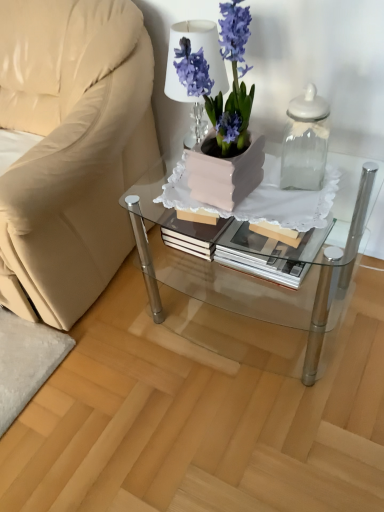
Question: Should I look upward or downward to see beige fabric chair at left?

Choices:
 (A) up
 (B) down

Answer: (A)

Question: Considering the relative sizes of white glossy table lamp at upper center and matte ceramic vase at center in the image provided, is white glossy table lamp at upper center shorter than matte ceramic vase at center?

Choices:
 (A) no
 (B) yes

Answer: (B)

Question: From the image's perspective, is white glossy table lamp at upper center above matte ceramic vase at center?

Choices:
 (A) no
 (B) yes

Answer: (B)

Question: Does white glossy table lamp at upper center have a smaller size compared to matte ceramic vase at center?

Choices:
 (A) no
 (B) yes

Answer: (B)

Question: From a real-world perspective, is white glossy table lamp at upper center positioned over matte ceramic vase at center based on gravity?

Choices:
 (A) no
 (B) yes

Answer: (A)

Question: Is white glossy table lamp at upper center surrounding matte ceramic vase at center?

Choices:
 (A) yes
 (B) no

Answer: (B)

Question: Considering the relative positions of white glossy table lamp at upper center and matte ceramic vase at center in the image provided, is white glossy table lamp at upper center to the right of matte ceramic vase at center from the viewer's perspective?

Choices:
 (A) no
 (B) yes

Answer: (A)

Question: Considering the relative positions of matte ceramic vase at center and clear glass jar at upper right in the image provided, is matte ceramic vase at center in front of clear glass jar at upper right?

Choices:
 (A) yes
 (B) no

Answer: (A)

Question: From a real-world perspective, is matte ceramic vase at center located higher than clear glass jar at upper right?

Choices:
 (A) no
 (B) yes

Answer: (B)

Question: Is matte ceramic vase at center placed right next to clear glass jar at upper right?

Choices:
 (A) yes
 (B) no

Answer: (B)

Question: Could clear glass jar at upper right be considered to be inside matte ceramic vase at center?

Choices:
 (A) yes
 (B) no

Answer: (B)

Question: Is matte ceramic vase at center located outside clear glass jar at upper right?

Choices:
 (A) yes
 (B) no

Answer: (A)

Question: Does matte ceramic vase at center lie behind clear glass jar at upper right?

Choices:
 (A) yes
 (B) no

Answer: (B)

Question: Is white glossy table lamp at upper center far from clear glass jar at upper right?

Choices:
 (A) no
 (B) yes

Answer: (A)